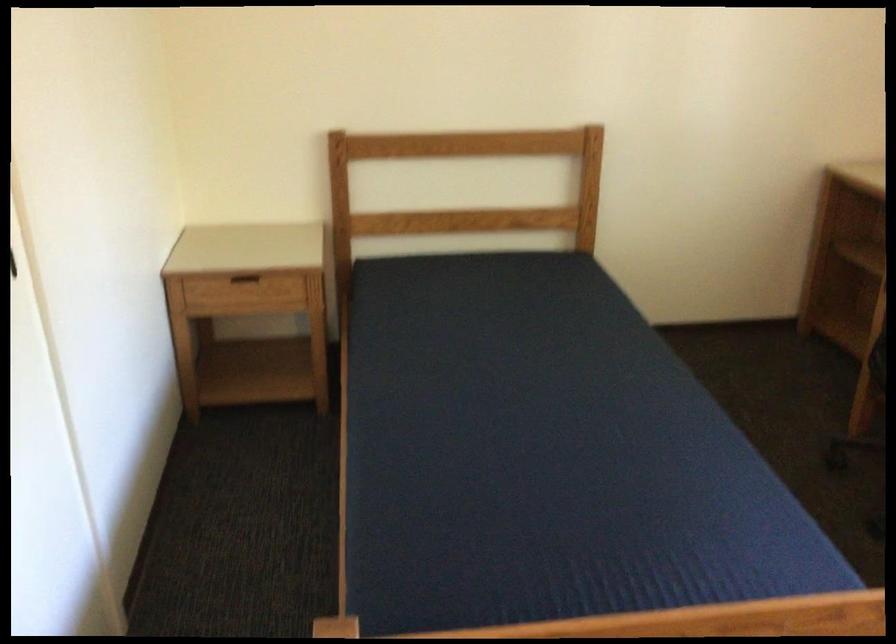
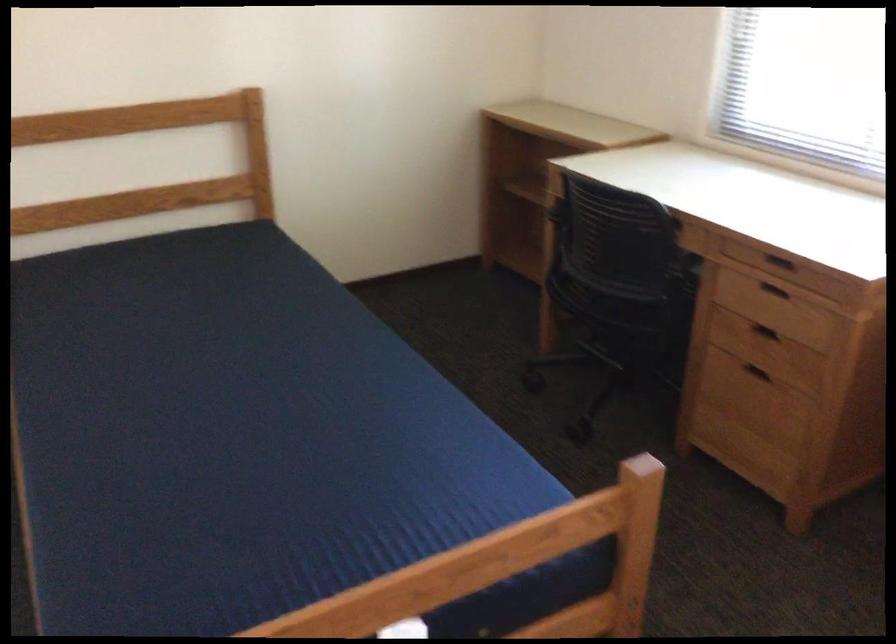
What movement of the cameraman would produce the second image?

The cameraman walked toward right, forward.